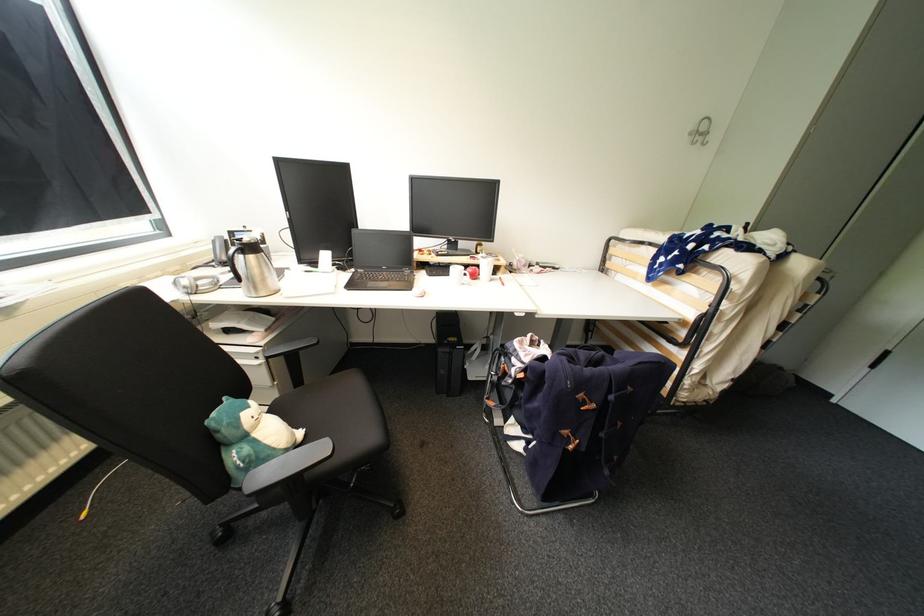
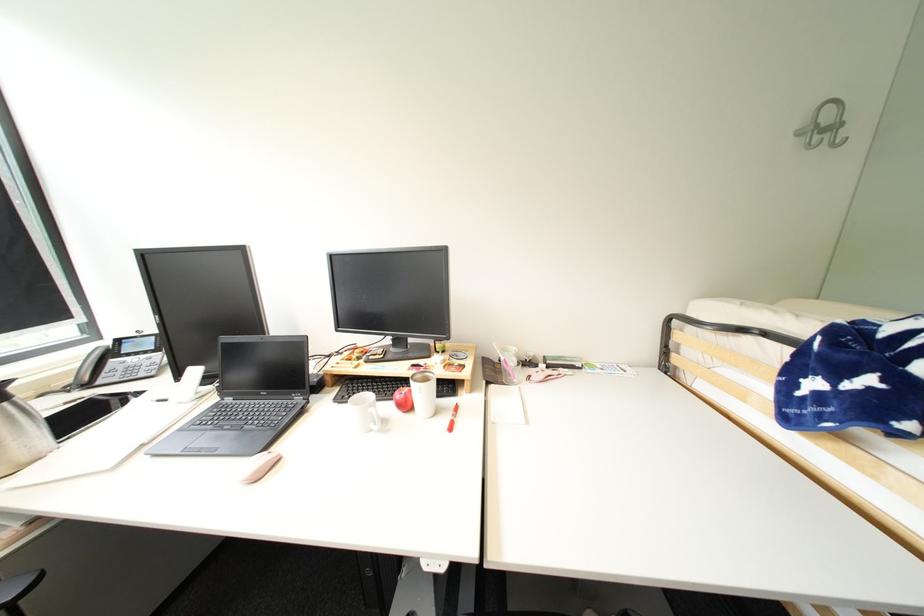
Find the pixel in the second image that matches (x=711, y=135) in the first image.

(841, 128)